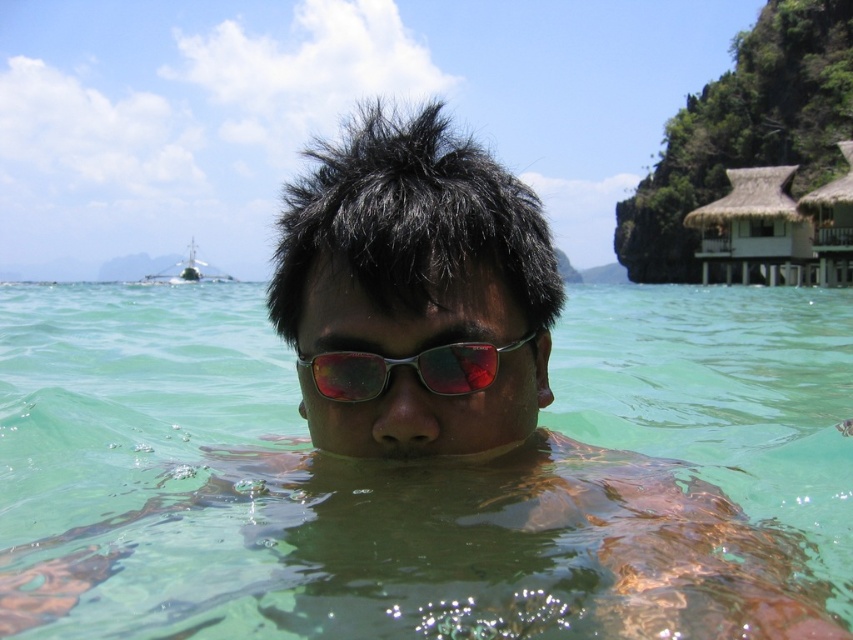
Between white thatch hut at upper right and shiny metallic sunglasses at center, which one appears on the left side from the viewer's perspective?

shiny metallic sunglasses at center

Does white thatch hut at upper right have a lesser width compared to shiny metallic sunglasses at center?

No, white thatch hut at upper right is not thinner than shiny metallic sunglasses at center.

The height and width of the screenshot is (640, 853). What are the coordinates of `white thatch hut at upper right` in the screenshot? It's located at (753, 227).